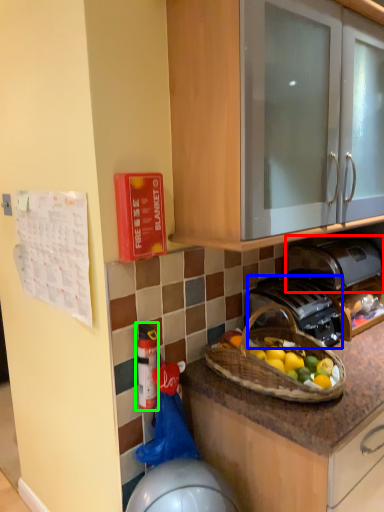
Question: Which object is positioned farthest from toaster (highlighted by a red box)? Select from gas stove (highlighted by a blue box) and extinguisher (highlighted by a green box).

Choices:
 (A) gas stove
 (B) extinguisher

Answer: (B)